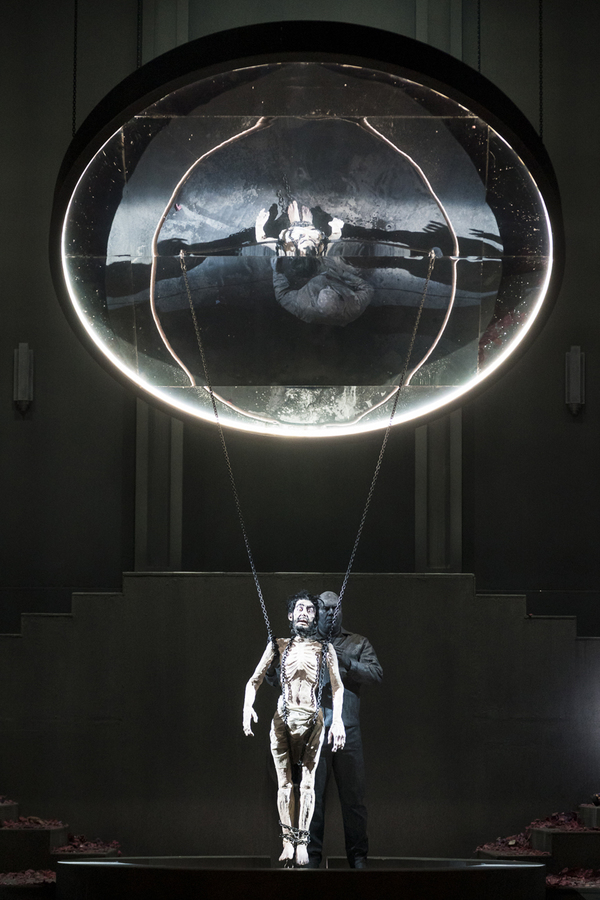
You are a GUI agent. You are given a task and a screenshot of the screen. Output one action in this format:
    pyautogui.click(x=<x>, y=<y>)
    Task: Click on the staircases
    The width and height of the screenshot is (600, 900).
    Given the screenshot: What is the action you would take?
    519,595, 75,604